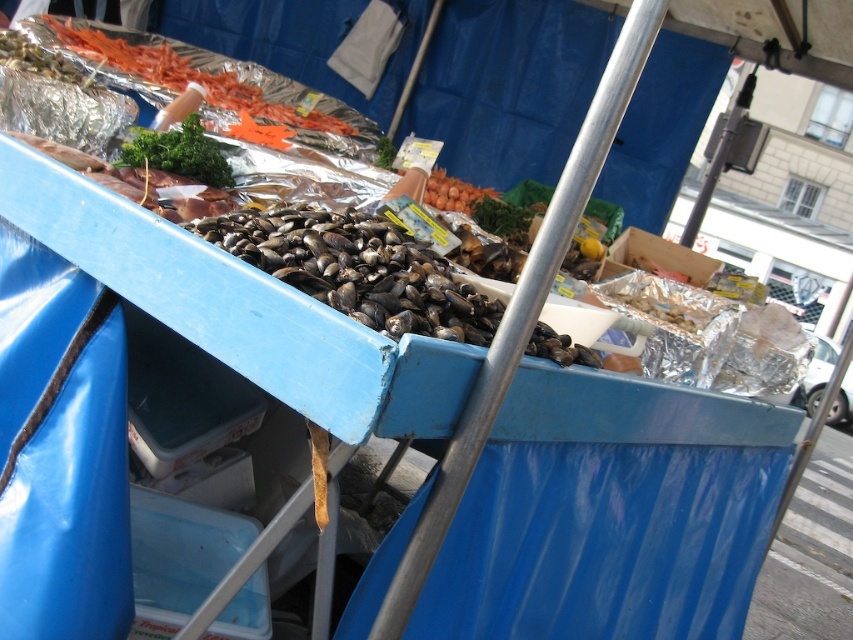
Can you confirm if shiny dark shells at center is smaller than green leafymaterial/texturevegetable at upper left?

Actually, shiny dark shells at center might be larger than green leafymaterial/texturevegetable at upper left.

Can you confirm if shiny dark shells at center is positioned to the right of green leafymaterial/texturevegetable at upper left?

Indeed, shiny dark shells at center is positioned on the right side of green leafymaterial/texturevegetable at upper left.

Where is `shiny dark shells at center`? shiny dark shells at center is located at coordinates (357, 268).

Where is `shiny dark shells at center`? shiny dark shells at center is located at coordinates (357, 268).